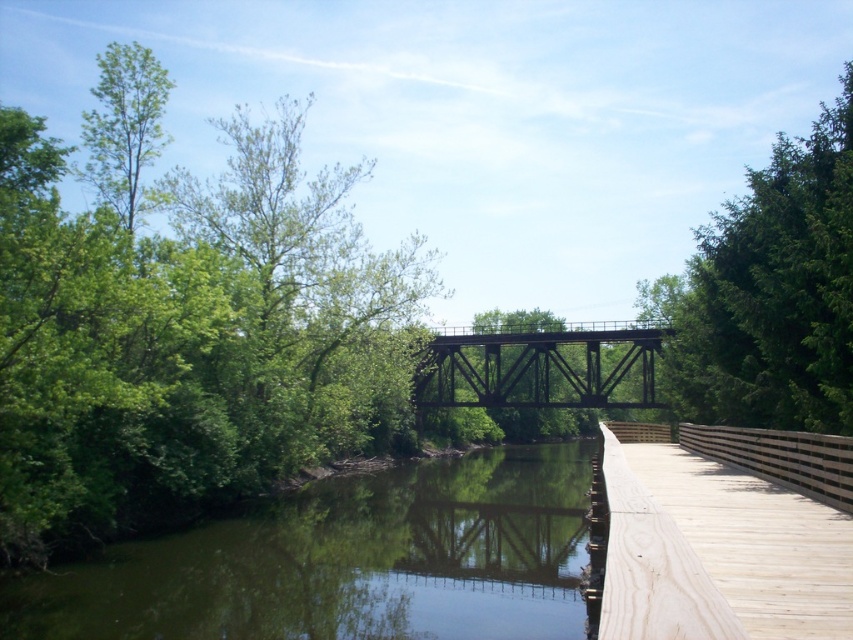
Based on the scene description, where is the green leafy tree at left located in terms of its 2D coordinates?

The green leafy tree at left is located at the 2D coordinates of point (x=184, y=323).

You are standing at the wooden bridge in the scene and looking towards the water. There are two points marked on the bridge surface at coordinates point (x=103, y=310) and point (x=227, y=609). Which point is closer to your viewpoint?

Point (x=103, y=310) is further to the camera than point (x=227, y=609), so the point closer to your viewpoint is point (x=227, y=609).